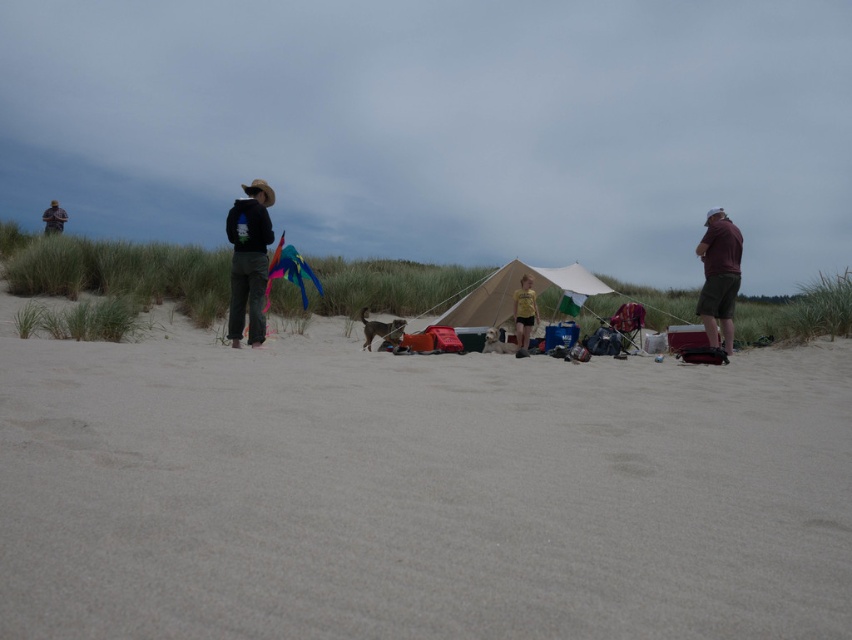
You are planning to set up a picnic area on the beach. You have a beige canvas tent at center and a multicolored fabric kite at center. Considering the space between them, can you place a picnic blanket that requires 15 feet of clear space between the tent and the kite?

The beige canvas tent at center and multicolored fabric kite at center are 17.85 feet apart, which is more than the required 15 feet of clear space. Therefore, you can place the picnic blanket between them with sufficient space.